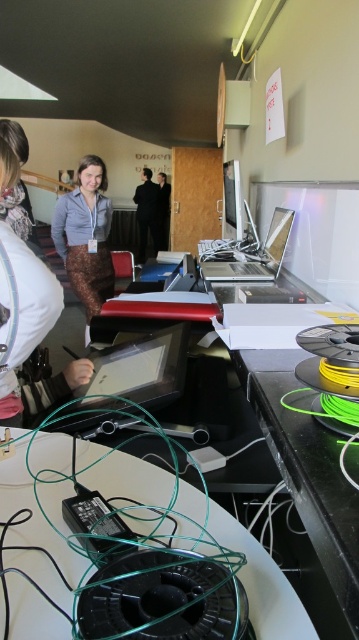
Question: Does green wire at lower center have a greater width compared to matte black tablet at center?

Choices:
 (A) no
 (B) yes

Answer: (B)

Question: Does matte gray sweater at center appear on the left side of black fabric person at center?

Choices:
 (A) no
 (B) yes

Answer: (A)

Question: Is matte black tablet at center smaller than matte gray sweater at center?

Choices:
 (A) yes
 (B) no

Answer: (A)

Question: Which is nearer to the dark gray suit at center?

Choices:
 (A) matte gray sweater at center
 (B) black fabric person at center
 (C) silver metallic laptop at center

Answer: (B)

Question: Which of these objects is positioned closest to the matte black tablet at center?

Choices:
 (A) matte gray sweater at center
 (B) dark gray suit at center
 (C) green wire at lower center
 (D) silver metallic laptop at center

Answer: (C)

Question: Which of the following is the closest to the observer?

Choices:
 (A) (76, 193)
 (B) (164, 182)
 (C) (232, 268)

Answer: (C)